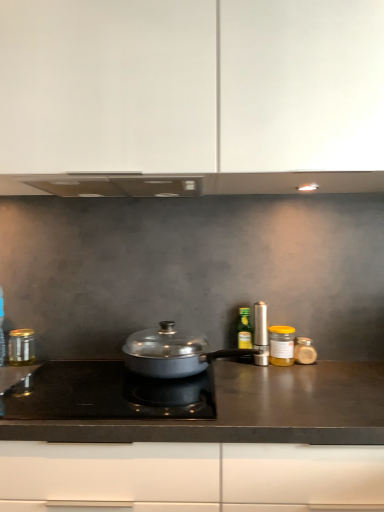
Find the location of a particular element. This screenshot has height=512, width=384. free space underneath matte silver pan at center, which appears as the second kitchen appliance when viewed from the left (from a real-world perspective) is located at coordinates (210, 373).